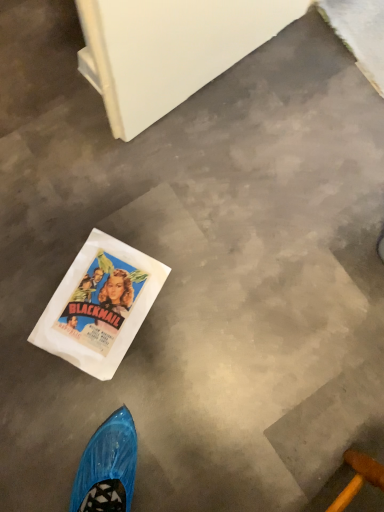
Identify the location of free space in front of white paper comic book at lower left. Image resolution: width=384 pixels, height=512 pixels. (53, 420).